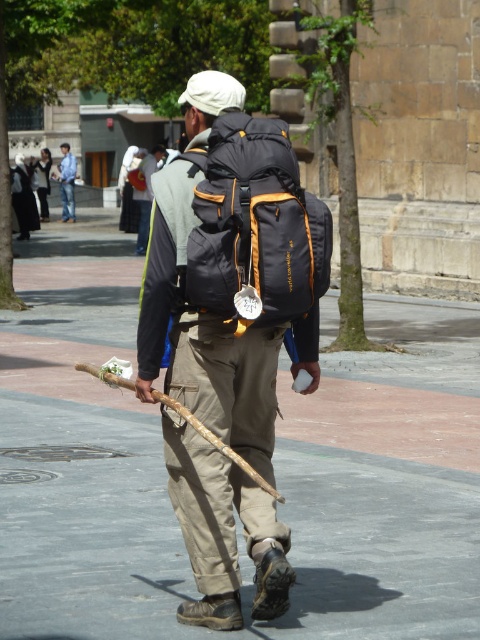
You are a photographer trying to capture the backpack and jeans in the scene. Since the black fabric backpack at center is not as tall as the blue denim jeans at center, which object should you focus on to ensure both are fully in frame without cropping?

Since the black fabric backpack at center is shorter than the blue denim jeans at center, you should focus on framing the blue denim jeans at center to ensure both objects are fully visible without cropping.

You are a tailor trying to determine which item is wider between the black fabric backpack at center and the blue denim jeans at center. Which one is wider?

The blue denim jeans at center is wider than the black fabric backpack at center.